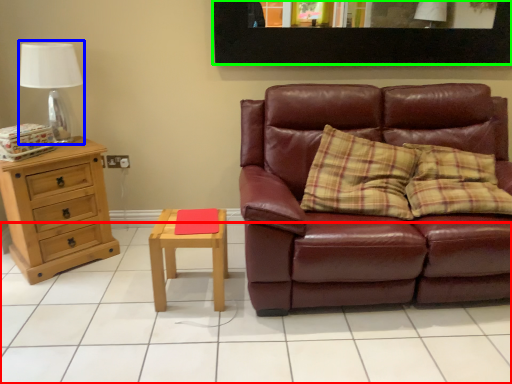
Question: Estimate the real-world distances between objects in this image. Which object is closer to tile (highlighted by a red box), table lamp (highlighted by a blue box) or picture frame (highlighted by a green box)?

Choices:
 (A) table lamp
 (B) picture frame

Answer: (A)